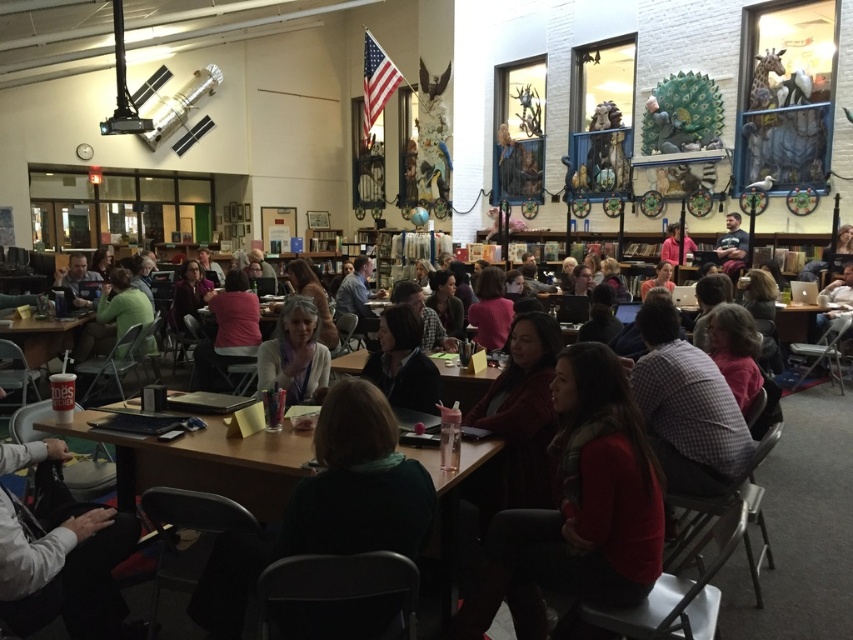
You are standing at the entrance of the room and want to find the light beige sweater at center. According to the coordinates provided, in which direction should you walk to locate it?

The light beige sweater at center is located at coordinates point (294, 355). Since the coordinates are in the center area, you should walk straight ahead from the entrance to reach it.

You are a person who is 6 feet tall standing at the wooden table at center. You want to pick up the matte black jacket at center without moving your feet. Can you reach it?

The distance between the wooden table at center and the matte black jacket at center is 29.36 inches. Since 29.36 inches is approximately 2.45 feet, and the person is 6 feet tall, they can likely reach the jacket without moving their feet as the distance is within a typical arm reach.